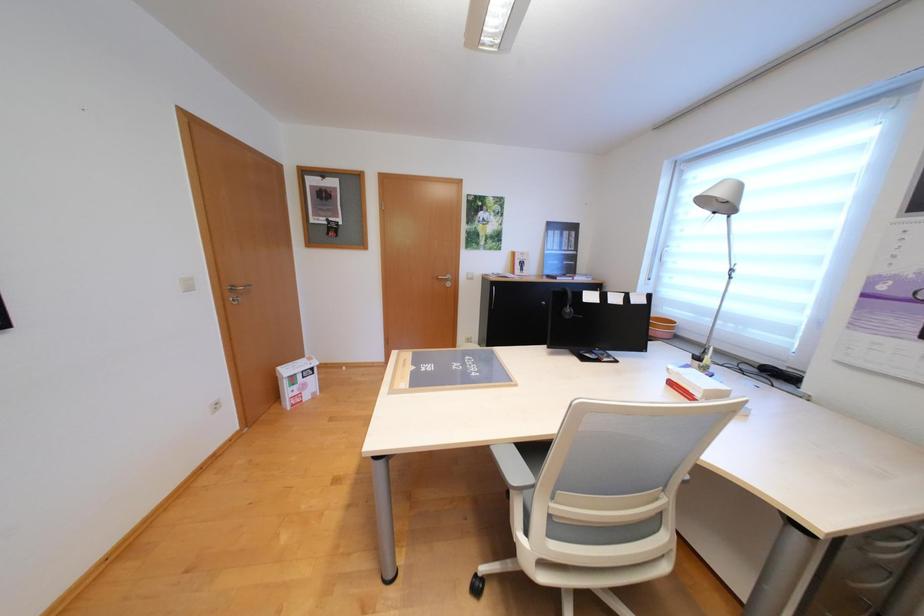
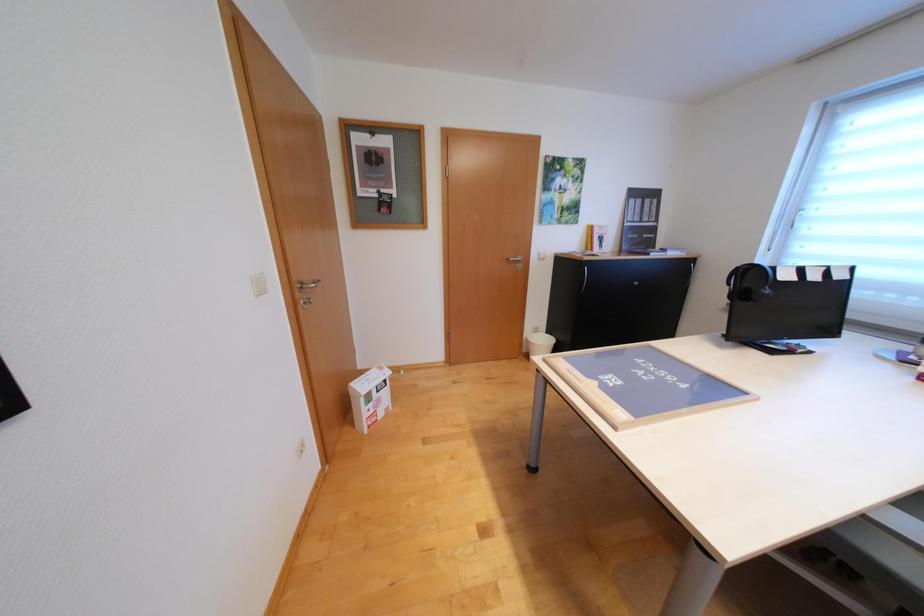
The images are taken continuously from a first-person perspective. In which direction are you moving?

The cameraman moved toward left, forward.